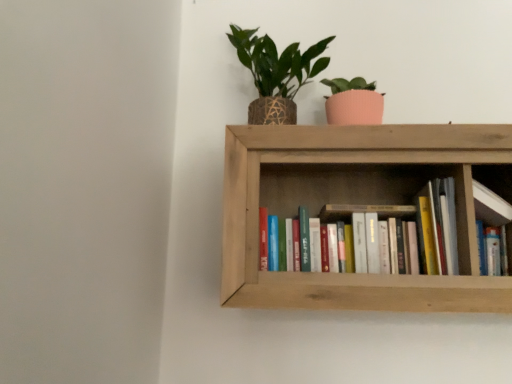
Question: Can you confirm if green woven pot at upper center is wider than hardcover books at center?

Choices:
 (A) yes
 (B) no

Answer: (A)

Question: Is green woven pot at upper center at the left side of hardcover books at center?

Choices:
 (A) no
 (B) yes

Answer: (B)

Question: Does green woven pot at upper center have a larger size compared to hardcover books at center?

Choices:
 (A) yes
 (B) no

Answer: (A)

Question: From the image's perspective, does green woven pot at upper center appear higher than hardcover books at center?

Choices:
 (A) no
 (B) yes

Answer: (B)

Question: Considering the relative positions of green woven pot at upper center and hardcover books at center in the image provided, is green woven pot at upper center behind hardcover books at center?

Choices:
 (A) yes
 (B) no

Answer: (A)

Question: From the image's perspective, is hardcover books at center above or below green woven pot at upper center?

Choices:
 (A) above
 (B) below

Answer: (B)

Question: Is point (356, 175) positioned closer to the camera than point (241, 61)?

Choices:
 (A) closer
 (B) farther

Answer: (B)

Question: Would you say hardcover books at center is to the left or to the right of green woven pot at upper center in the picture?

Choices:
 (A) left
 (B) right

Answer: (B)

Question: Is hardcover books at center in front of or behind green woven pot at upper center in the image?

Choices:
 (A) front
 (B) behind

Answer: (A)

Question: In terms of height, does green woven pot at upper center look taller or shorter compared to wooden bookshelf at upper right?

Choices:
 (A) short
 (B) tall

Answer: (B)

Question: Does point (252, 119) appear closer or farther from the camera than point (498, 175)?

Choices:
 (A) farther
 (B) closer

Answer: (A)

Question: Which is correct: green woven pot at upper center is inside wooden bookshelf at upper right, or outside of it?

Choices:
 (A) outside
 (B) inside

Answer: (A)

Question: In the image, is green woven pot at upper center positioned in front of or behind wooden bookshelf at upper right?

Choices:
 (A) behind
 (B) front

Answer: (A)

Question: From the image's perspective, is wooden bookshelf at center located above or below wooden bookshelf at upper right?

Choices:
 (A) below
 (B) above

Answer: (B)

Question: Is wooden bookshelf at center inside the boundaries of wooden bookshelf at upper right, or outside?

Choices:
 (A) outside
 (B) inside

Answer: (A)